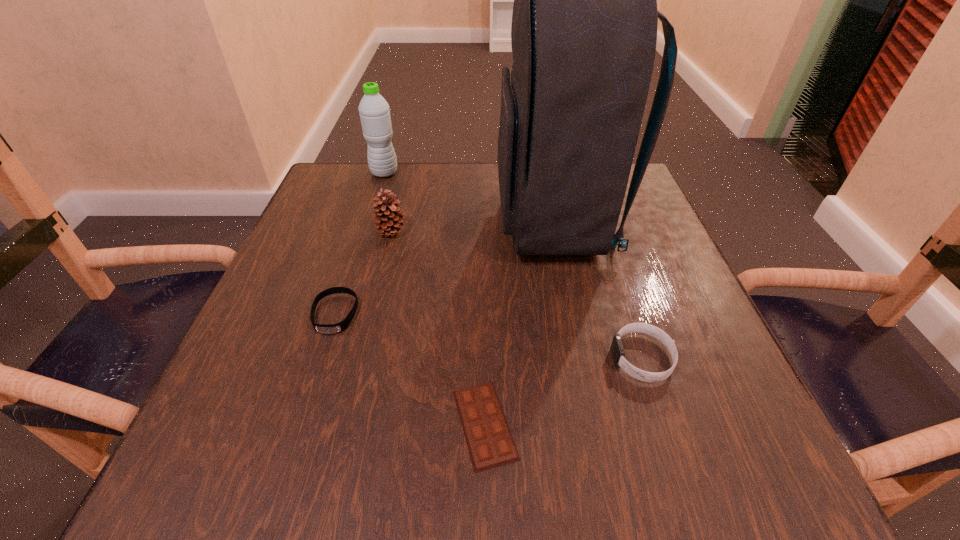
You are a GUI agent. You are given a task and a screenshot of the screen. Output one action in this format:
    pyautogui.click(x=<x>, y=<y>)
    Task: Click on the backpack
    
    Given the screenshot: What is the action you would take?
    pyautogui.click(x=584, y=26)

Locate an element on the screen. the farthest object is located at coordinates [374, 111].

Identify the location of water bottle. Image resolution: width=960 pixels, height=540 pixels. (374, 111).

Where is `the third tallest object`? The image size is (960, 540). the third tallest object is located at coordinates (389, 219).

At what (x,y) coordinates should I click in order to perform the action: click on the third shortest object. Please return your answer as a coordinate pair (x, y). This screenshot has height=540, width=960. Looking at the image, I should click on (617, 349).

I want to click on the right wristband, so click(617, 349).

Where is `the left wristband`? The image size is (960, 540). the left wristband is located at coordinates (339, 327).

Image resolution: width=960 pixels, height=540 pixels. Find the location of `the shorter wristband`. the shorter wristband is located at coordinates (339, 327).

The width and height of the screenshot is (960, 540). What are the coordinates of `chocolate bar` in the screenshot? It's located at (488, 437).

You are a GUI agent. You are given a task and a screenshot of the screen. Output one action in this format:
    pyautogui.click(x=<x>, y=<y>)
    Task: Click on the vacant area situated 0.180m on the front-facing side of the backpack
    The image size is (960, 540).
    Given the screenshot: What is the action you would take?
    pyautogui.click(x=413, y=222)